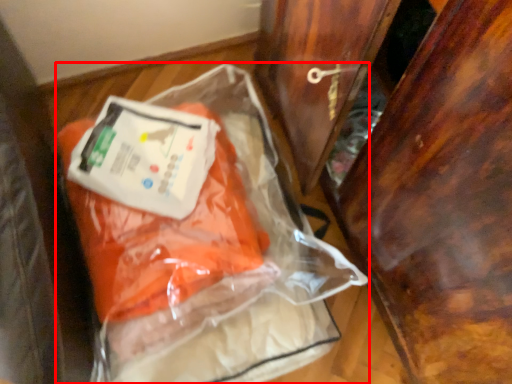
Question: Observing the image, what is the correct spatial positioning of plastic bag (annotated by the red box) in reference to furniture?

Choices:
 (A) left
 (B) right

Answer: (A)